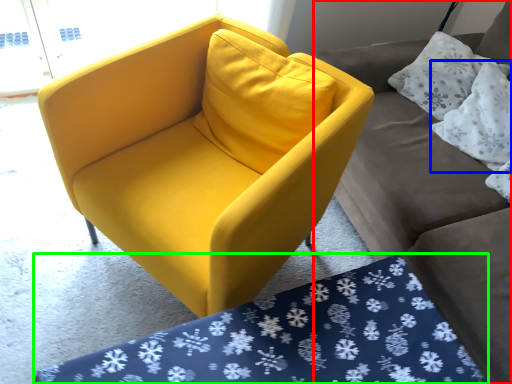
Question: Considering the real-world distances, which object is closest to studio couch (highlighted by a red box)? pillow (highlighted by a blue box) or mat (highlighted by a green box).

Choices:
 (A) pillow
 (B) mat

Answer: (A)